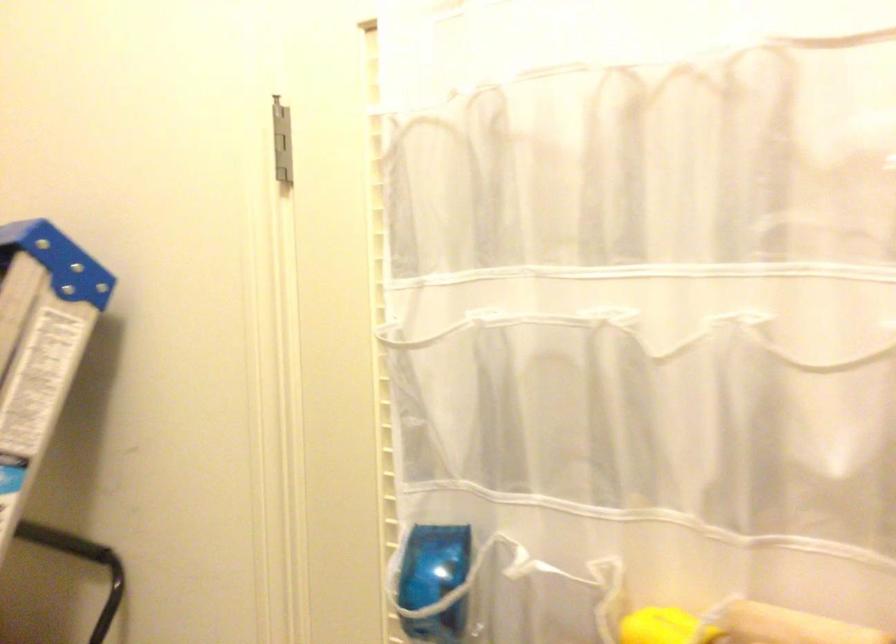
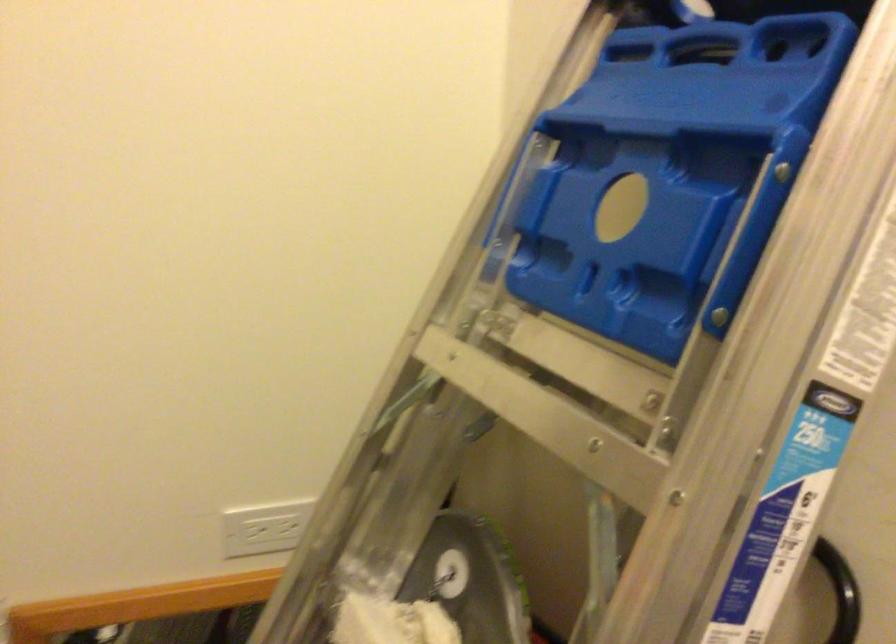
Which direction would the cameraman need to move to produce the second image?

The cameraman walked toward left, forward.